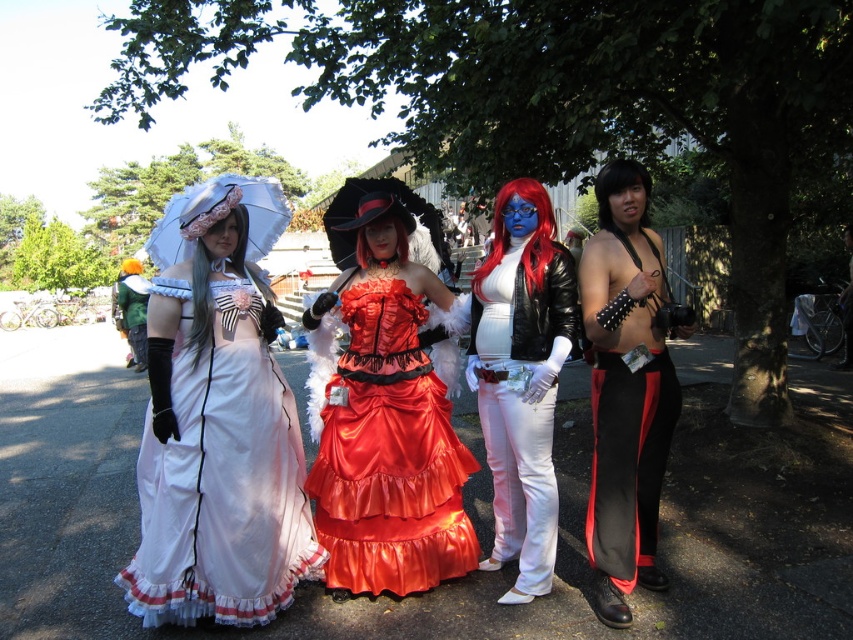
Which object is located at the coordinates point (218, 420)?

The point (218, 420) corresponds to the matte white dress at left.

Based on the scene description, which object is positioned to the left when comparing the shiny satin dress at center and the white matte pants at center?

The shiny satin dress at center is located to the left of the white matte pants at center according to the description.

You are standing in front of the four cosplayers and want to touch both the point at point (221, 380) and the point at point (505, 368). Which point will require you to reach further back?

The point at point (505, 368) will require reaching further back because it is farther from the viewer compared to point (221, 380).